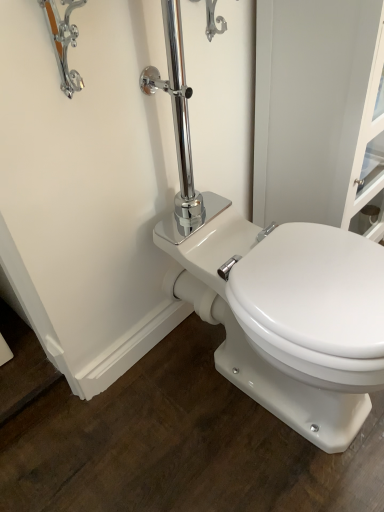
Question: Does white glossy screen door at upper right have a lesser height compared to chrome metallic faucet at upper left?

Choices:
 (A) yes
 (B) no

Answer: (B)

Question: Does white glossy screen door at upper right have a smaller size compared to chrome metallic faucet at upper left?

Choices:
 (A) no
 (B) yes

Answer: (A)

Question: Does white glossy screen door at upper right appear on the right side of chrome metallic faucet at upper left?

Choices:
 (A) no
 (B) yes

Answer: (B)

Question: From the image's perspective, does white glossy screen door at upper right appear higher than chrome metallic faucet at upper left?

Choices:
 (A) yes
 (B) no

Answer: (B)

Question: Is white glossy screen door at upper right facing towards chrome metallic faucet at upper left?

Choices:
 (A) yes
 (B) no

Answer: (B)

Question: In the image, is white glossy screen door at upper right on the left side or the right side of chrome metallic faucet at upper left?

Choices:
 (A) left
 (B) right

Answer: (B)

Question: From a real-world perspective, is white glossy screen door at upper right above or below chrome metallic faucet at upper left?

Choices:
 (A) below
 (B) above

Answer: (A)

Question: Considering their positions, is white glossy screen door at upper right located in front of or behind chrome metallic faucet at upper left?

Choices:
 (A) behind
 (B) front

Answer: (A)

Question: Considering the positions of white glossy screen door at upper right and chrome metallic faucet at upper left in the image, is white glossy screen door at upper right wider or thinner than chrome metallic faucet at upper left?

Choices:
 (A) wide
 (B) thin

Answer: (A)

Question: Considering the positions of point (61, 68) and point (289, 25), is point (61, 68) closer or farther from the camera than point (289, 25)?

Choices:
 (A) closer
 (B) farther

Answer: (A)

Question: From the image's perspective, is chrome metallic faucet at upper left located above or below white glossy screen door at upper right?

Choices:
 (A) below
 (B) above

Answer: (B)

Question: In terms of height, does chrome metallic faucet at upper left look taller or shorter compared to white glossy screen door at upper right?

Choices:
 (A) tall
 (B) short

Answer: (B)

Question: Would you say chrome metallic faucet at upper left is to the left or to the right of white glossy screen door at upper right in the picture?

Choices:
 (A) right
 (B) left

Answer: (B)

Question: From the image's perspective, is white glossy screen door at upper right located above or below white glossy porcelain toilet at center?

Choices:
 (A) above
 (B) below

Answer: (A)

Question: From their relative heights in the image, would you say white glossy screen door at upper right is taller or shorter than white glossy porcelain toilet at center?

Choices:
 (A) short
 (B) tall

Answer: (B)